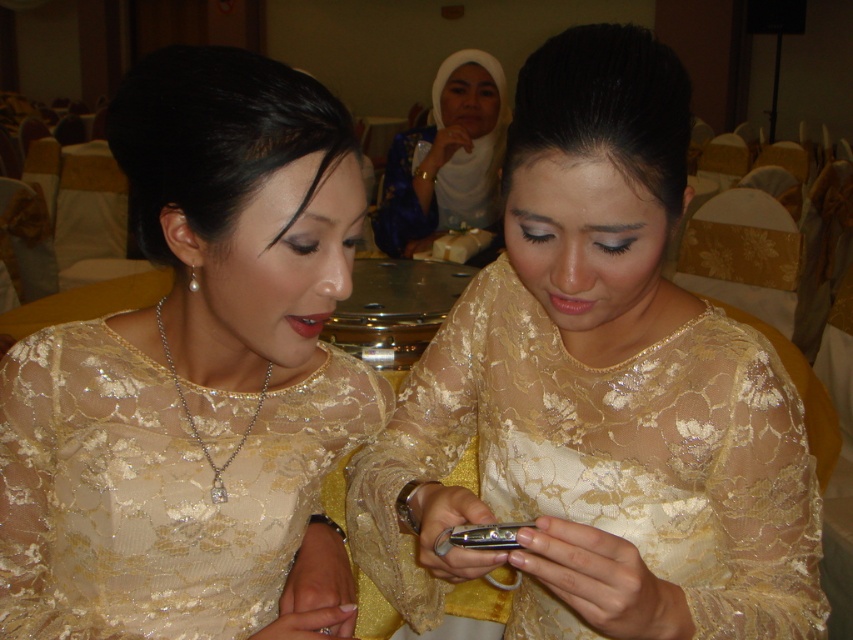
Question: Can you confirm if lace fabric phone at center is positioned to the left of white lace hijab at upper center?

Choices:
 (A) yes
 (B) no

Answer: (B)

Question: Which point appears farthest from the camera in this image?

Choices:
 (A) [x=444, y=332]
 (B) [x=268, y=612]
 (C) [x=479, y=545]
 (D) [x=477, y=67]

Answer: (D)

Question: Observing the image, what is the correct spatial positioning of lace dress at center in reference to silver metallic smartphone at center?

Choices:
 (A) left
 (B) right

Answer: (A)

Question: Considering the relative positions of lace dress at center and white lace hijab at upper center in the image provided, where is lace dress at center located with respect to white lace hijab at upper center?

Choices:
 (A) below
 (B) above

Answer: (A)

Question: Which object appears closest to the camera in this image?

Choices:
 (A) lace dress at center
 (B) silver metallic smartphone at center
 (C) lace fabric phone at center
 (D) white lace hijab at upper center

Answer: (C)

Question: Among these points, which one is farthest from the camera?

Choices:
 (A) (515, 531)
 (B) (135, 561)
 (C) (432, 186)
 (D) (425, 497)

Answer: (C)